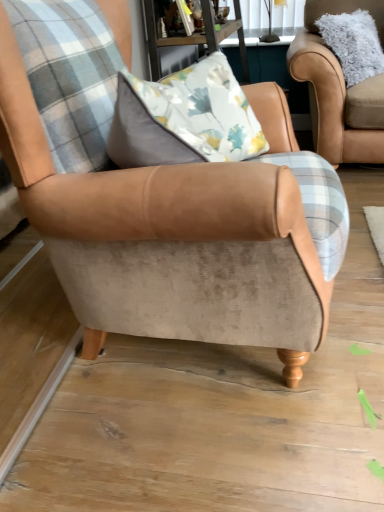
Question: Can you confirm if wooden table at upper center is positioned to the right of suede armchair at center, positioned as the second chair in back-to-front order?

Choices:
 (A) yes
 (B) no

Answer: (A)

Question: Is suede armchair at center, the first chair in the front-to-back sequence, surrounded by wooden table at upper center?

Choices:
 (A) yes
 (B) no

Answer: (B)

Question: Is the position of wooden table at upper center more distant than that of suede armchair at center, positioned as the second chair in back-to-front order?

Choices:
 (A) yes
 (B) no

Answer: (A)

Question: Can you confirm if wooden table at upper center is positioned to the left of suede armchair at center, the first chair in the front-to-back sequence?

Choices:
 (A) yes
 (B) no

Answer: (B)

Question: From the image's perspective, does wooden table at upper center appear lower than suede armchair at center, marked as the 1th chair in a left-to-right arrangement?

Choices:
 (A) no
 (B) yes

Answer: (A)

Question: Visually, is fuzzy beige armchair at upper right, which appears as the 1th chair when viewed from the top, positioned to the left or to the right of wooden table at upper center?

Choices:
 (A) right
 (B) left

Answer: (A)

Question: From their relative heights in the image, would you say fuzzy beige armchair at upper right, which appears as the 1th chair when viewed from the top, is taller or shorter than wooden table at upper center?

Choices:
 (A) tall
 (B) short

Answer: (B)

Question: Is fuzzy beige armchair at upper right, which is the first chair from back to front, in front of or behind wooden table at upper center in the image?

Choices:
 (A) front
 (B) behind

Answer: (B)

Question: Considering the positions of fuzzy beige armchair at upper right, the 2th chair in the left-to-right sequence, and wooden table at upper center in the image, is fuzzy beige armchair at upper right, the 2th chair in the left-to-right sequence, bigger or smaller than wooden table at upper center?

Choices:
 (A) small
 (B) big

Answer: (A)

Question: Does point (132, 326) appear closer or farther from the camera than point (322, 124)?

Choices:
 (A) farther
 (B) closer

Answer: (B)

Question: Looking at their shapes, would you say suede armchair at center, marked as the 1th chair in a left-to-right arrangement, is wider or thinner than fuzzy beige armchair at upper right, which is the first chair from back to front?

Choices:
 (A) thin
 (B) wide

Answer: (B)

Question: Considering the positions of suede armchair at center, the 1th chair from the bottom, and fuzzy beige armchair at upper right, which appears as the 1th chair when viewed from the top, in the image, is suede armchair at center, the 1th chair from the bottom, taller or shorter than fuzzy beige armchair at upper right, which appears as the 1th chair when viewed from the top,?

Choices:
 (A) tall
 (B) short

Answer: (A)

Question: Is suede armchair at center, the first chair in the front-to-back sequence, in front of or behind fuzzy beige armchair at upper right, arranged as the second chair when viewed from the front, in the image?

Choices:
 (A) behind
 (B) front

Answer: (B)

Question: Considering their positions, is wooden table at upper center located in front of or behind suede armchair at center, the first chair in the front-to-back sequence?

Choices:
 (A) front
 (B) behind

Answer: (B)

Question: In terms of size, does wooden table at upper center appear bigger or smaller than suede armchair at center, the first chair in the front-to-back sequence?

Choices:
 (A) big
 (B) small

Answer: (B)